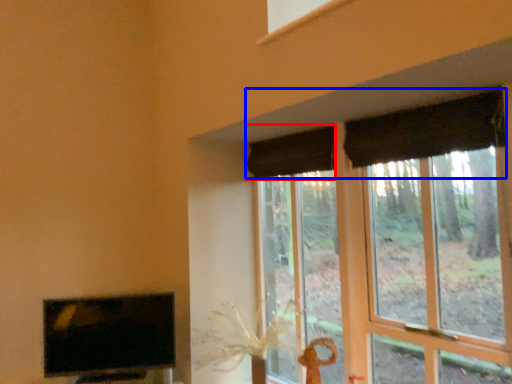
Question: Which point is further to the camera, curtain (highlighted by a red box) or curtain (highlighted by a blue box)?

Choices:
 (A) curtain
 (B) curtain

Answer: (A)